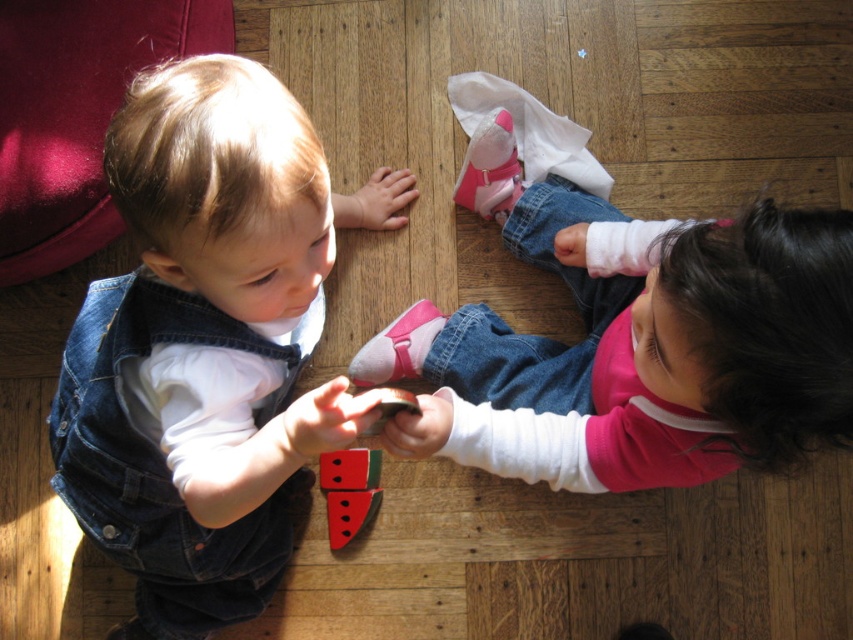
Question: Which object is closer to the camera taking this photo?

Choices:
 (A) watermelon-patterned wood block at center
 (B) pink fabric socks at lower center
 (C) denim overalls at left

Answer: (C)

Question: Does denim overalls at left appear under pink fabric socks at lower center?

Choices:
 (A) yes
 (B) no

Answer: (A)

Question: Does pink fabric socks at lower center appear under watermelon-patterned wood block at center?

Choices:
 (A) yes
 (B) no

Answer: (B)

Question: Which object is closer to the camera taking this photo?

Choices:
 (A) pink fabric socks at lower center
 (B) denim overalls at left
 (C) watermelon-patterned wood block at center

Answer: (B)

Question: Can you confirm if pink fabric socks at lower center is positioned above watermelon-patterned wood block at center?

Choices:
 (A) no
 (B) yes

Answer: (B)

Question: Which point is closer to the camera?

Choices:
 (A) (566, 358)
 (B) (120, 156)
 (C) (337, 541)

Answer: (B)